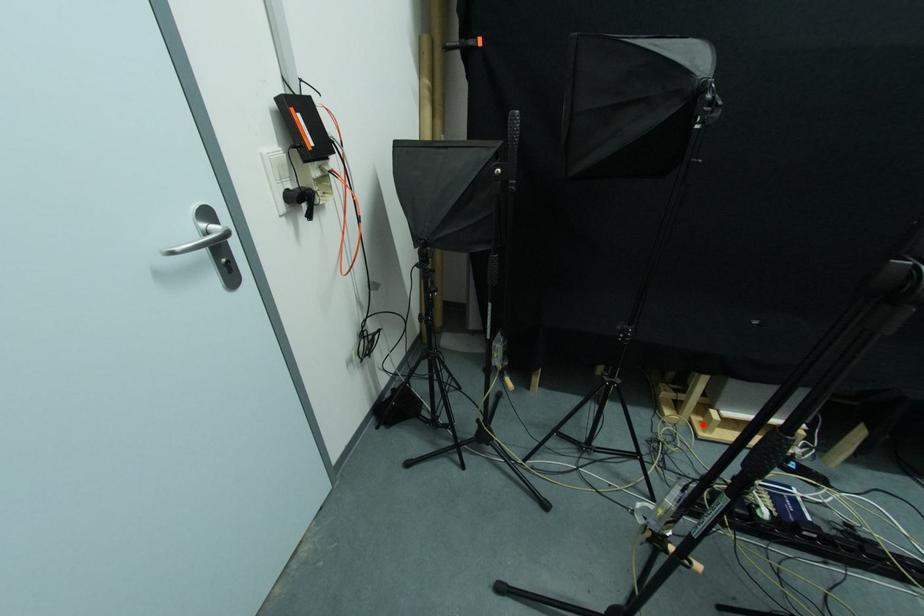
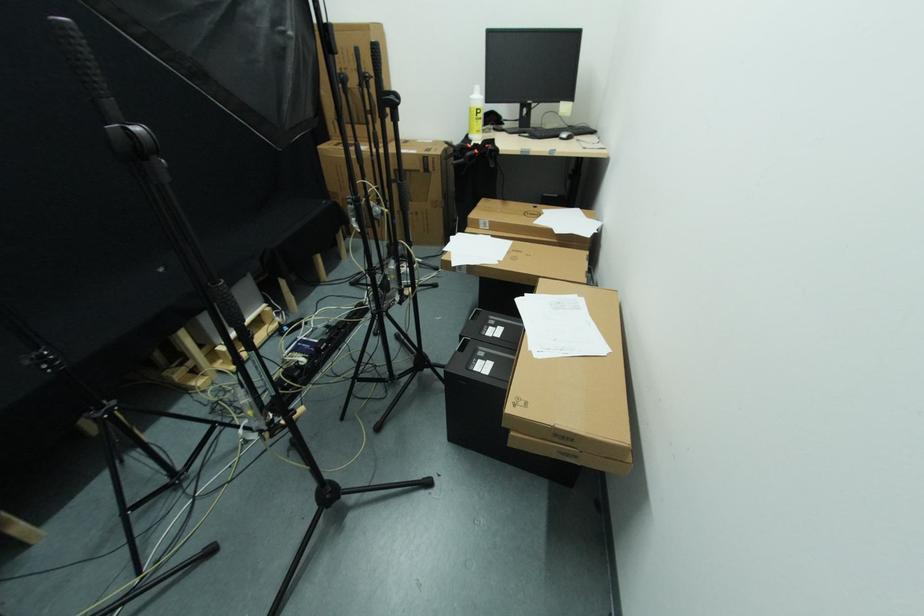
Question: I am providing you with two images of the same scene from different viewpoints. Image1 has a red point marked. In image2, the corresponding 3D location appears at what relative position? Reply with the corresponding letter.

Choices:
 (A) Closer
 (B) Farther

Answer: (A)